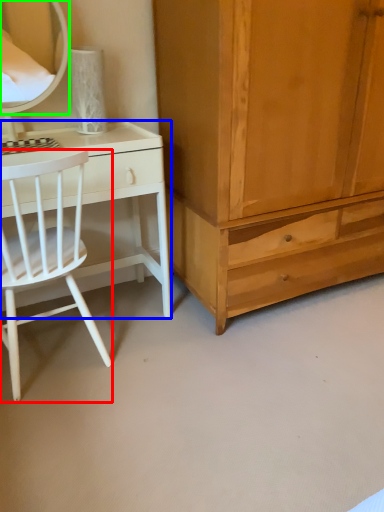
Question: Based on their relative distances, which object is nearer to chair (highlighted by a red box)? Choose from desk (highlighted by a blue box) and mirror (highlighted by a green box).

Choices:
 (A) desk
 (B) mirror

Answer: (A)